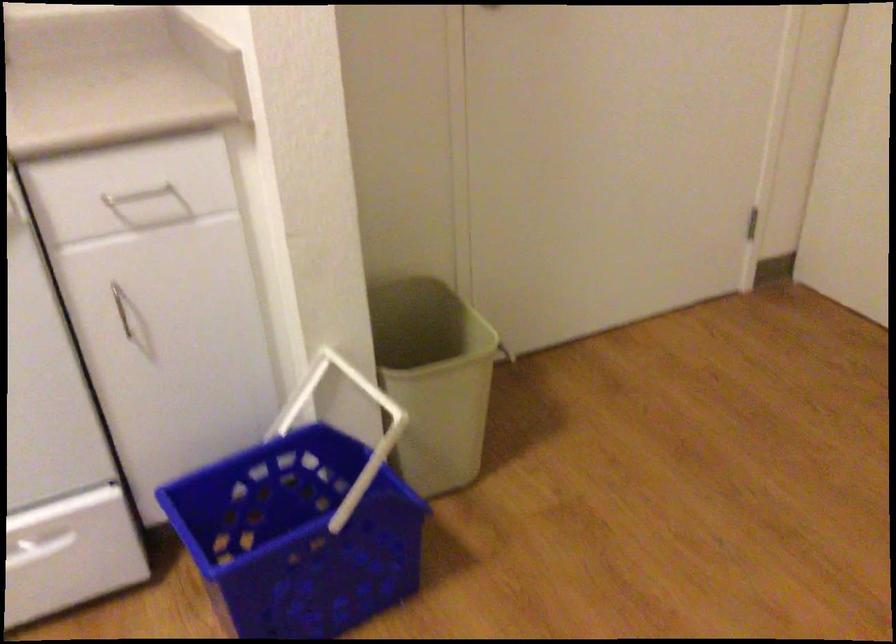
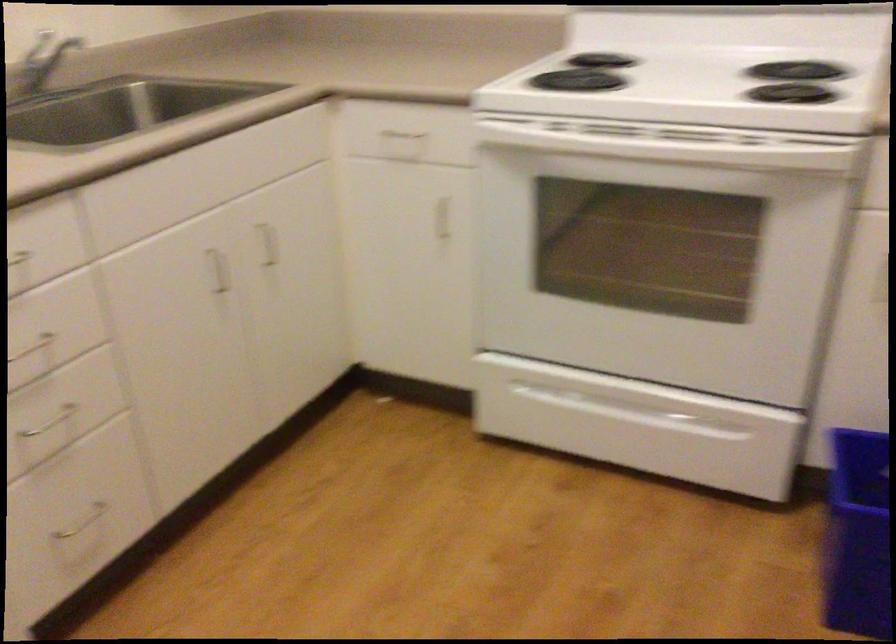
Question: The first image is from the beginning of the video and the second image is from the end. How did the camera likely rotate when shooting the video?

Choices:
 (A) Left
 (B) Right
 (C) Up
 (D) Down

Answer: (A)